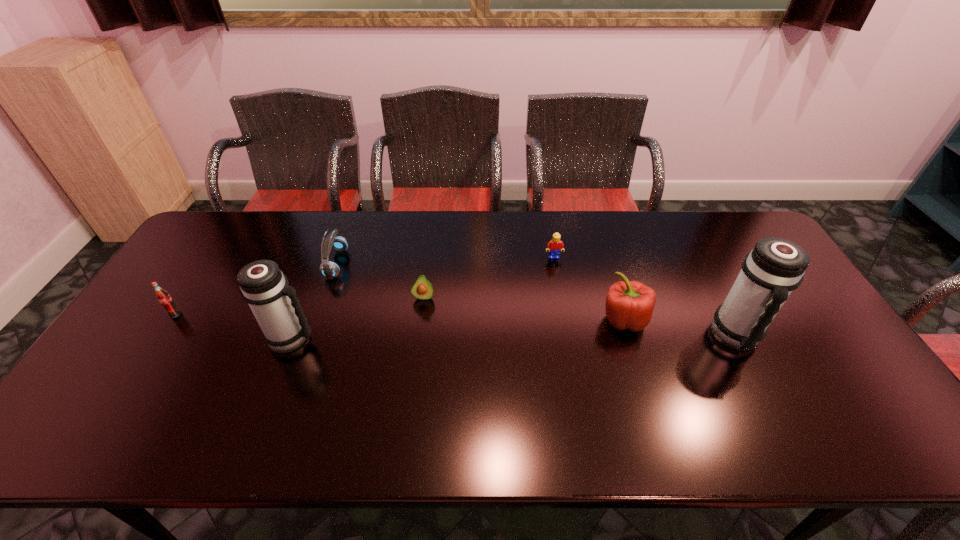
Image resolution: width=960 pixels, height=540 pixels. What are the coordinates of `the shorter thermos bottle` in the screenshot? It's located at (263, 286).

In order to click on the left thermos bottle in this screenshot , I will do `click(263, 286)`.

Image resolution: width=960 pixels, height=540 pixels. I want to click on the taller thermos bottle, so click(x=775, y=267).

The image size is (960, 540). Find the location of `the rightmost object`. the rightmost object is located at coordinates (775, 267).

At what (x,y) coordinates should I click in order to perform the action: click on Lego. Please return your answer as a coordinate pair (x, y). Looking at the image, I should click on (554, 246).

The width and height of the screenshot is (960, 540). I want to click on headset, so click(334, 240).

Locate an element on the screen. avocado is located at coordinates (422, 289).

This screenshot has width=960, height=540. Find the location of `the fifth nearest object`. the fifth nearest object is located at coordinates (422, 289).

The image size is (960, 540). What are the coordinates of `the leftmost object` in the screenshot? It's located at (164, 298).

This screenshot has height=540, width=960. Identify the location of the second object from right to left. (629, 305).